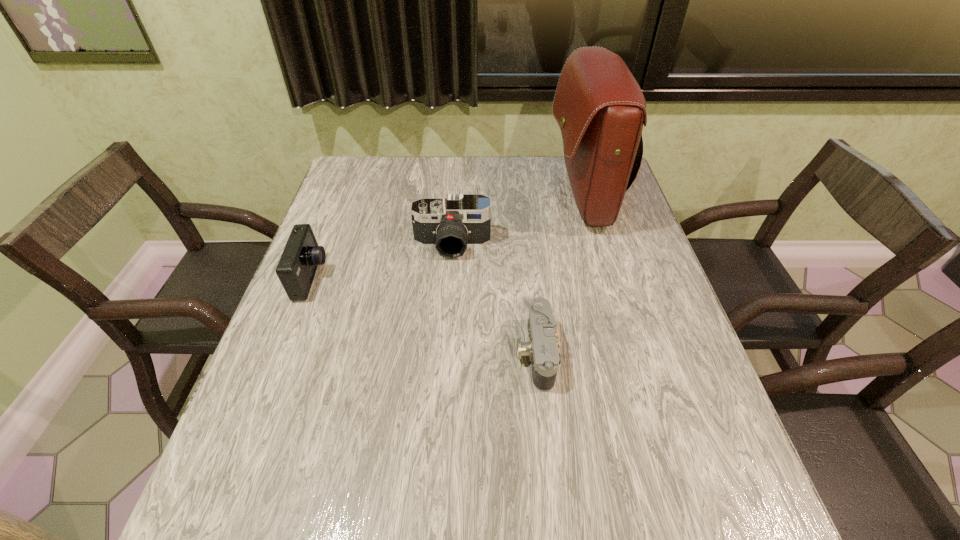
This screenshot has width=960, height=540. In the image, there is a desktop. What are the coordinates of `blank space at the left edge` in the screenshot? It's located at (316, 448).

The image size is (960, 540). In order to click on free location at the right edge of the desktop in this screenshot , I will do `click(634, 281)`.

Image resolution: width=960 pixels, height=540 pixels. I want to click on free region at the far left corner, so click(377, 194).

In the image, there is a desktop. Where is `vacant space at the near left corner`? vacant space at the near left corner is located at coordinates (202, 517).

You are a GUI agent. You are given a task and a screenshot of the screen. Output one action in this format:
    pyautogui.click(x=<x>, y=<y>)
    Task: Click on the vacant space that is in between the shortest camera and the tallest object
    
    Given the screenshot: What is the action you would take?
    pyautogui.click(x=559, y=275)

The width and height of the screenshot is (960, 540). Identify the location of empty location between the second camera from right to left and the leftmost camera. (382, 261).

Identify the location of vacant space in between the nearest camera and the leftmost camera. The image size is (960, 540). (423, 316).

At what (x,y) coordinates should I click in order to perform the action: click on free spot between the nearest object and the leftmost object. Please return your answer as a coordinate pair (x, y). Image resolution: width=960 pixels, height=540 pixels. Looking at the image, I should click on (423, 316).

Locate an element on the screen. This screenshot has width=960, height=540. vacant area between the satchel and the third object from right to left is located at coordinates (517, 221).

Where is `unoccupied area between the nearest camera and the leftmost camera`? Image resolution: width=960 pixels, height=540 pixels. unoccupied area between the nearest camera and the leftmost camera is located at coordinates (423, 316).